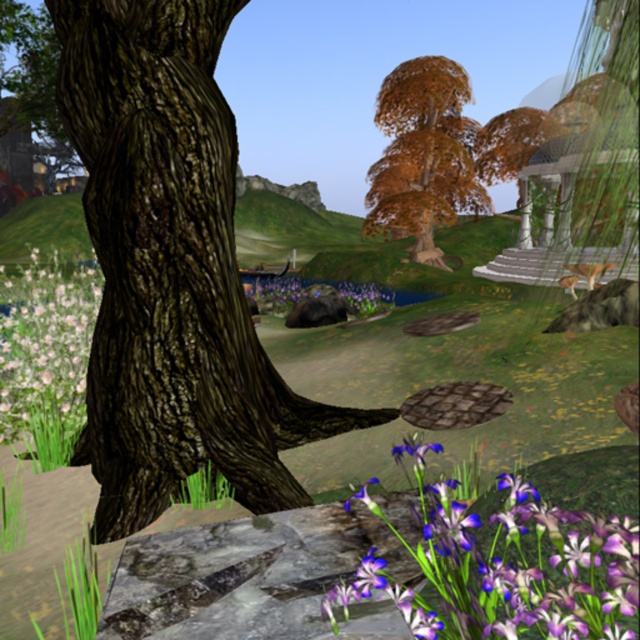
Which is in front, point (454, 177) or point (538, 132)?

Point (454, 177) is more forward.

Is orange-brown textured tree at center bigger than orange-brown textured tree at upper center?

No.

Identify the location of orange-brown textured tree at center. This screenshot has height=640, width=640. (422, 154).

Locate an element on the screen. This screenshot has width=640, height=640. orange-brown textured tree at center is located at coordinates (422, 154).

Does rough bark tree at left have a smaller size compared to orange-brown textured tree at center?

Indeed, rough bark tree at left has a smaller size compared to orange-brown textured tree at center.

Who is more forward, (188, 253) or (401, 138)?

Point (188, 253) is more forward.

Between point (236, 384) and point (419, 92), which one is positioned in front?

Point (236, 384) is in front.

At what (x,y) coordinates should I click in order to perform the action: click on rough bark tree at left. Please return your answer as a coordinate pair (x, y). Looking at the image, I should click on (172, 268).

How far apart are orange-brown textured tree at center and purple matte flowers at center?

orange-brown textured tree at center and purple matte flowers at center are 7.13 meters apart.

Is orange-brown textured tree at center thinner than purple matte flowers at center?

In fact, orange-brown textured tree at center might be wider than purple matte flowers at center.

Find the location of a particular element. orange-brown textured tree at center is located at coordinates (422, 154).